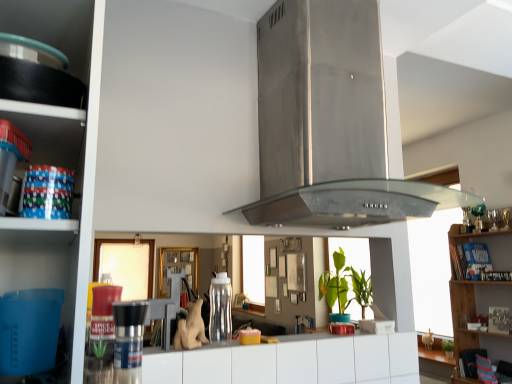
Question: From a real-world perspective, is brushed metal pepper grinder at center, which is the second appliance in right-to-left order, physically located above or below white matte drawer at center?

Choices:
 (A) below
 (B) above

Answer: (B)

Question: Considering their positions, is brushed metal pepper grinder at center, which is the second appliance in right-to-left order, located in front of or behind white matte drawer at center?

Choices:
 (A) front
 (B) behind

Answer: (A)

Question: Which object is the farthest from the stainless steel exhaust hood at upper center?

Choices:
 (A) white matte drawer at center
 (B) wooden bookshelf at right, arranged as the 3th shelf when viewed from the front
 (C) brushed metal pepper grinder at center, acting as the second appliance starting from the back
 (D) matte black pan at left, which ranks as the 1th shelf in top-to-bottom order
 (E) blue plastic bowls at left, placed as the 2th shelf when sorted from back to front

Answer: (B)

Question: Estimate the real-world distances between objects in this image. Which object is farther from the white matte drawer at center?

Choices:
 (A) brushed metal pepper grinder at center, acting as the first appliance starting from the front
 (B) blue plastic bowls at left, placed as the 2th shelf when sorted from back to front
 (C) wooden bookshelf at right, marked as the 3th shelf in a top-to-bottom arrangement
 (D) clear plastic water bottle at center, acting as the 2th appliance starting from the front
 (E) matte black pan at left, arranged as the first shelf when viewed from the front

Answer: (C)